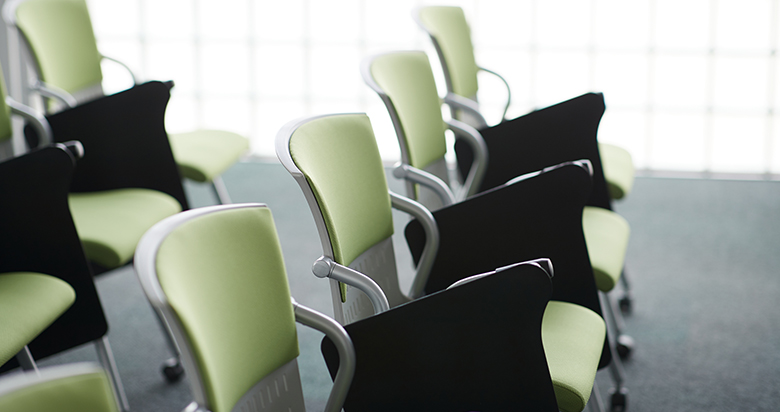
Where is `chair leg`? The image size is (780, 412). chair leg is located at coordinates (168, 374), (222, 198), (615, 398), (629, 352), (628, 302), (105, 364).